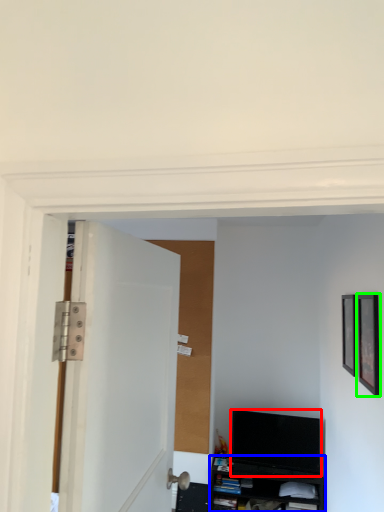
Question: Which object is positioned closest to television (highlighted by a red box)? Select from cabinetry (highlighted by a blue box) and picture frame (highlighted by a green box).

Choices:
 (A) cabinetry
 (B) picture frame

Answer: (A)